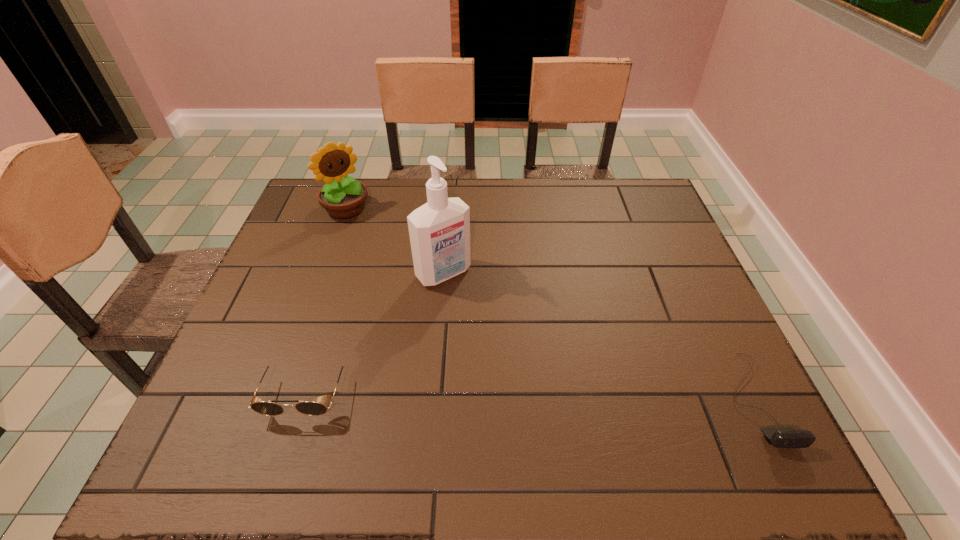
The image size is (960, 540). Identify the location of object located at the near left corner. (269, 408).

This screenshot has width=960, height=540. Identify the location of object at the near right corner. (781, 437).

At what (x,y) coordinates should I click in order to perform the action: click on vacant region at the far edge of the desktop. Please return your answer as a coordinate pair (x, y). This screenshot has height=540, width=960. Looking at the image, I should click on (562, 218).

Where is `free space at the near edge of the desktop`? free space at the near edge of the desktop is located at coordinates (625, 384).

In order to click on blank area at the left edge in this screenshot , I will do `click(308, 260)`.

Locate an element on the screen. Image resolution: width=960 pixels, height=540 pixels. vacant region at the right edge of the desktop is located at coordinates (648, 291).

The image size is (960, 540). In order to click on blank area at the far left corner in this screenshot , I will do `click(335, 222)`.

Where is `vacant space at the far right corner of the desktop`? vacant space at the far right corner of the desktop is located at coordinates (636, 200).

This screenshot has height=540, width=960. I want to click on vacant region at the near right corner of the desktop, so click(747, 411).

At what (x,y) coordinates should I click in order to perform the action: click on vacant space that's between the second object from right to left and the webcam. Please return your answer as a coordinate pair (x, y). This screenshot has width=960, height=540. Looking at the image, I should click on 599,336.